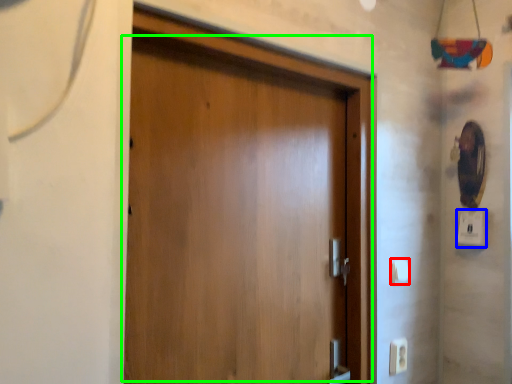
Question: Estimate the real-world distances between objects in this image. Which object is closer to light switch (highlighted by a red box), light switch (highlighted by a blue box) or door (highlighted by a green box)?

Choices:
 (A) light switch
 (B) door

Answer: (A)